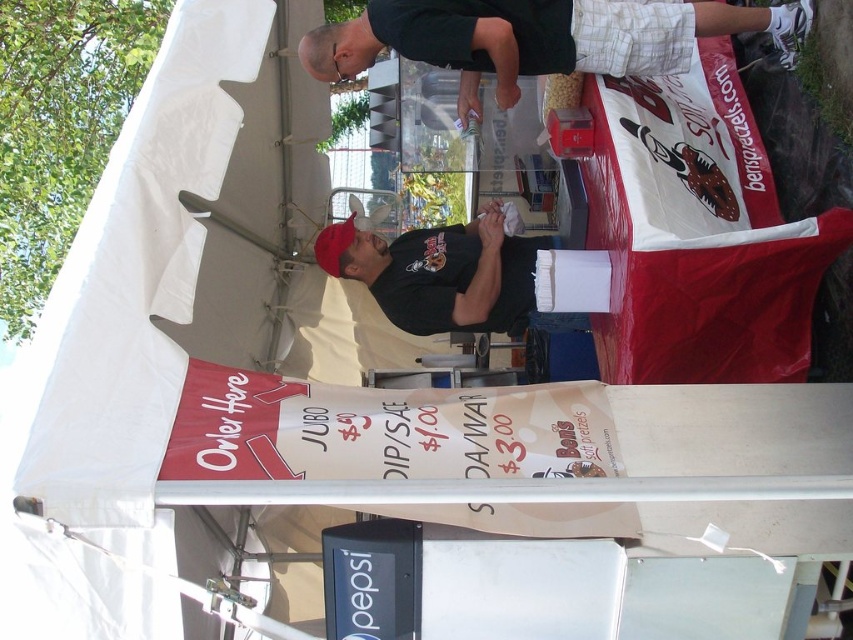
You are a customer standing at the entrance of Ben s Soft Pretzels stall. You see two people wearing black shirts inside the canopy. The first is the black shirt at upper center and the second is the black matte shirt at center. You need to hand over your payment to the closer one. Which one should you approach?

The black shirt at upper center is 3.91 feet away from the black matte shirt at center. Since you are at the entrance, the closer one would depend on their positions relative to you. However, based on the given distance between them, if you are equidistant from both, the black matte shirt at center is likely closer as it is positioned centrally, but without exact positioning from the entrance, it is unclear. Please clarify their positions relative to the entrance.

In the scene shown: You are a customer at Ben s Soft Pretzels stall. You see two people in black shirts. One is the cashier and the other is preparing food. Which person is closer to you, the one wearing the black shirt at upper center or the one in the black matte shirt at center?

The black shirt at upper center is closer to you because it is in front of the black matte shirt at center.

You are at the food stall under the white canopy tent. There is a point marked at coordinates (540,38). What object is located at this point?

The point at (540,38) is on the black shirt at upper center.